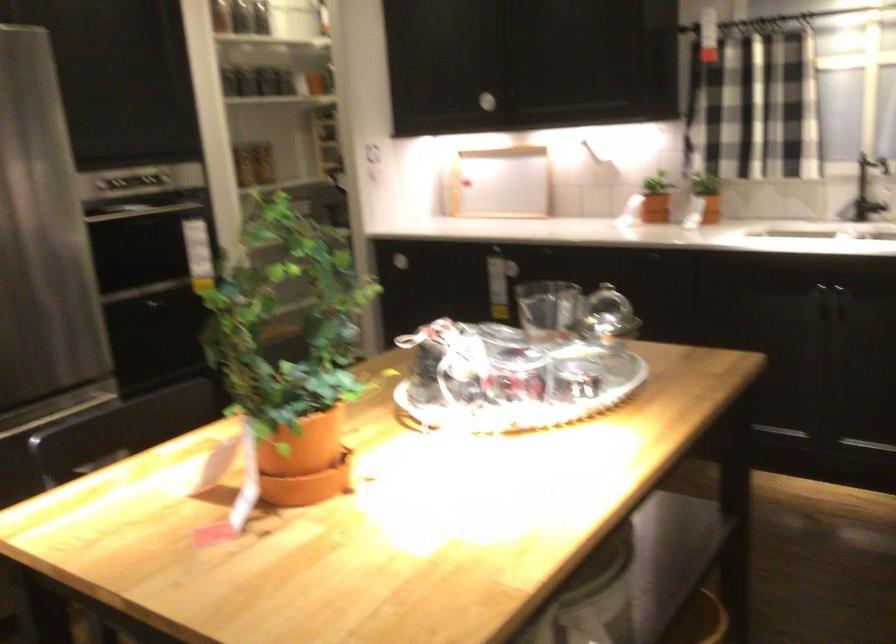
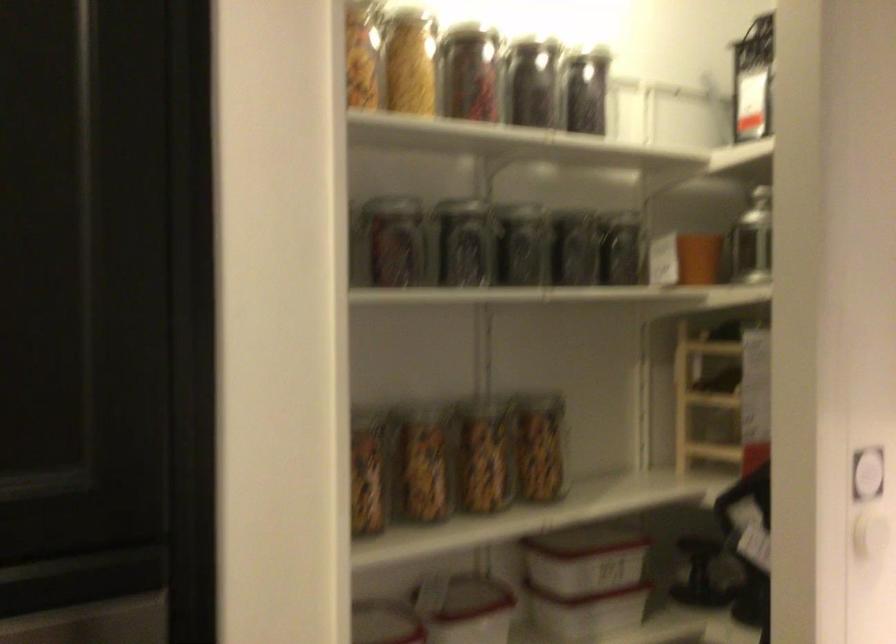
Where in the second image is the point corresponding to pixel 368 144 from the first image?

(867, 474)